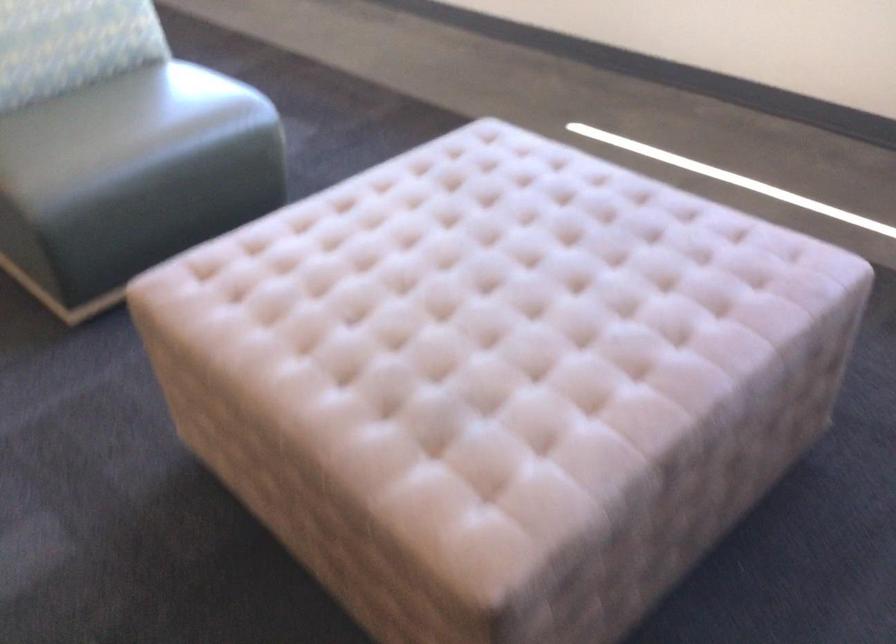
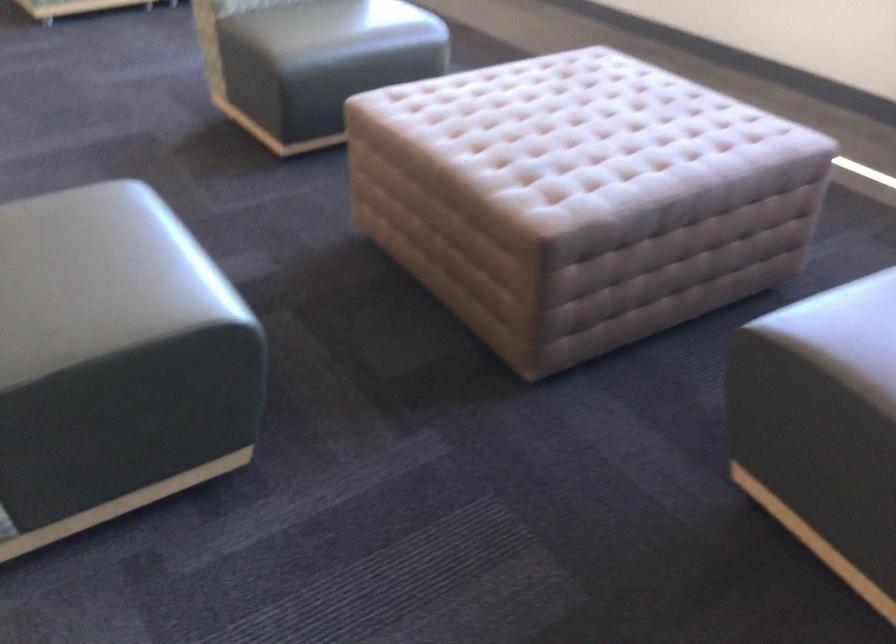
Where in the second image is the point corresponding to (x=104, y=138) from the first image?

(334, 26)